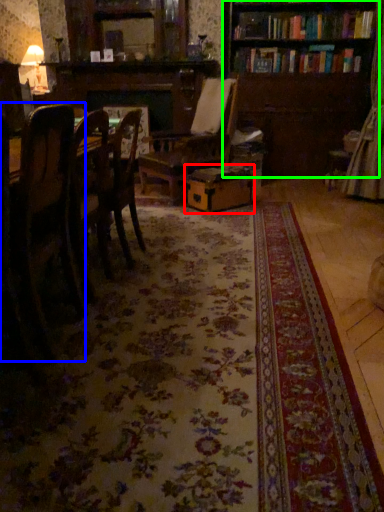
Question: Estimate the real-world distances between objects in this image. Which object is closer to cardboard box (highlighted by a red box), chair (highlighted by a blue box) or bookcase (highlighted by a green box)?

Choices:
 (A) chair
 (B) bookcase

Answer: (B)